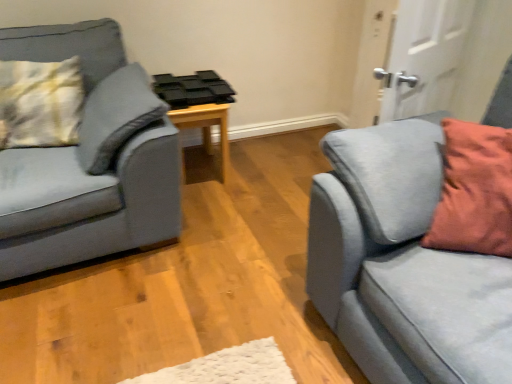
Question: Would you say white matte door at upper right is to the left or to the right of black plastic tray at center in the picture?

Choices:
 (A) left
 (B) right

Answer: (B)

Question: Based on their sizes in the image, would you say white matte door at upper right is bigger or smaller than black plastic tray at center?

Choices:
 (A) small
 (B) big

Answer: (A)

Question: Which object is the farthest from the black plastic tray at center?

Choices:
 (A) yellow-green textured pillow at left
 (B) velvet grey couch at left, the second studio couch in the right-to-left sequence
 (C) suede gray couch at right, which appears as the 1th studio couch when viewed from the right
 (D) white matte door at upper right

Answer: (C)

Question: Which is nearer to the velvet grey couch at left, placed as the first studio couch when sorted from left to right?

Choices:
 (A) suede gray couch at right, the 2th studio couch from the left
 (B) black plastic tray at center
 (C) yellow-green textured pillow at left
 (D) white matte door at upper right

Answer: (C)